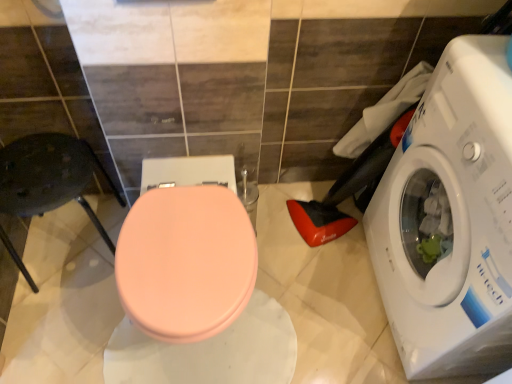
Question: Is metallic dark gray chair at left shorter than white glossy washing machine at right?

Choices:
 (A) yes
 (B) no

Answer: (A)

Question: From a real-world perspective, is metallic dark gray chair at left positioned under white glossy washing machine at right based on gravity?

Choices:
 (A) yes
 (B) no

Answer: (A)

Question: Is white glossy washing machine at right a part of metallic dark gray chair at left?

Choices:
 (A) yes
 (B) no

Answer: (B)

Question: Is white glossy washing machine at right at the back of metallic dark gray chair at left?

Choices:
 (A) no
 (B) yes

Answer: (A)

Question: Does metallic dark gray chair at left appear on the right side of white glossy washing machine at right?

Choices:
 (A) yes
 (B) no

Answer: (B)

Question: From a real-world perspective, is metallic dark gray chair at left on white glossy washing machine at right?

Choices:
 (A) yes
 (B) no

Answer: (B)

Question: Does white glossy washing machine at right have a lesser height compared to metallic dark gray chair at left?

Choices:
 (A) no
 (B) yes

Answer: (A)

Question: Could you tell me if white glossy washing machine at right is facing metallic dark gray chair at left?

Choices:
 (A) yes
 (B) no

Answer: (A)

Question: From a real-world perspective, is white glossy washing machine at right positioned over metallic dark gray chair at left based on gravity?

Choices:
 (A) yes
 (B) no

Answer: (A)

Question: Is white glossy washing machine at right next to metallic dark gray chair at left and touching it?

Choices:
 (A) no
 (B) yes

Answer: (A)

Question: Is white glossy washing machine at right positioned beyond the bounds of metallic dark gray chair at left?

Choices:
 (A) no
 (B) yes

Answer: (B)

Question: Would you say white glossy washing machine at right contains metallic dark gray chair at left?

Choices:
 (A) yes
 (B) no

Answer: (B)

Question: From a real-world perspective, is matte pink lid at center located higher than metallic dark gray chair at left?

Choices:
 (A) no
 (B) yes

Answer: (B)